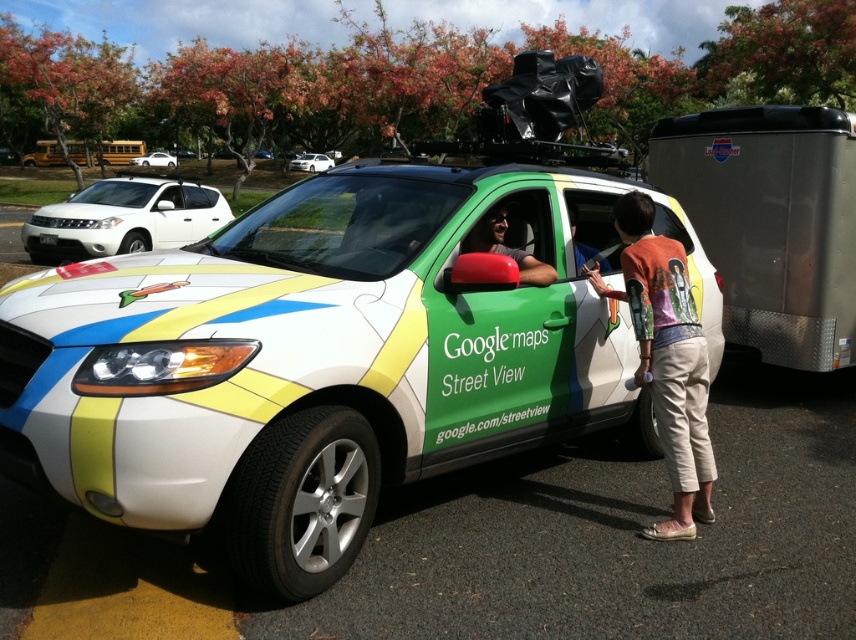
Question: Which of these objects is positioned closest to the white glossy sedan at center?

Choices:
 (A) white matte suv at upper left
 (B) matte green car door at center
 (C) white glossy sedan at upper left

Answer: (B)

Question: Does orange cotton shirt at center have a smaller size compared to matte green car door at center?

Choices:
 (A) no
 (B) yes

Answer: (A)

Question: Which point appears closest to the camera in this image?

Choices:
 (A) (693, 358)
 (B) (134, 214)
 (C) (318, 154)
 (D) (375, 269)

Answer: (D)

Question: Considering the relative positions of white matte suv at upper left and matte green car door at center in the image provided, where is white matte suv at upper left located with respect to matte green car door at center?

Choices:
 (A) right
 (B) left

Answer: (B)

Question: Is matte green car door at center wider than white glossy sedan at upper left?

Choices:
 (A) yes
 (B) no

Answer: (B)

Question: Which of the following is the closest to the observer?

Choices:
 (A) (462, 218)
 (B) (682, 305)
 (C) (295, 166)
 (D) (500, 234)

Answer: (A)